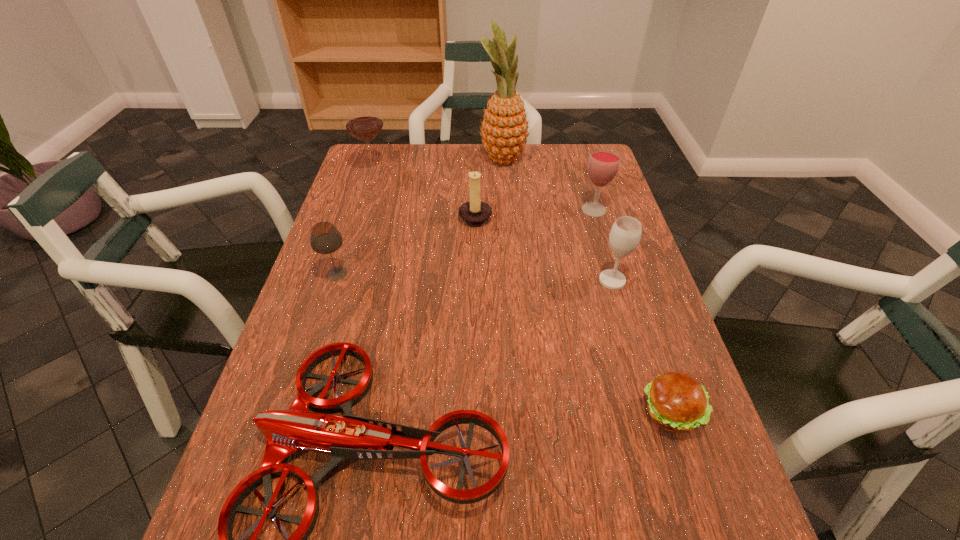
This screenshot has width=960, height=540. What are the coordinates of `wineglass object that ranks as the closest to the farthest wineglass` in the screenshot? It's located at (324, 238).

Identify the location of free spot that satisfies the following two spatial constraints: 1. on the wick of the candle holder; 2. on the right side of the hamburger. (473, 413).

You are a GUI agent. You are given a task and a screenshot of the screen. Output one action in this format:
    pyautogui.click(x=<x>, y=<y>)
    Task: Click on the blank space that satisfies the following two spatial constraints: 1. on the wick of the candle holder; 2. on the right side of the hamburger
    
    Given the screenshot: What is the action you would take?
    pyautogui.click(x=473, y=413)